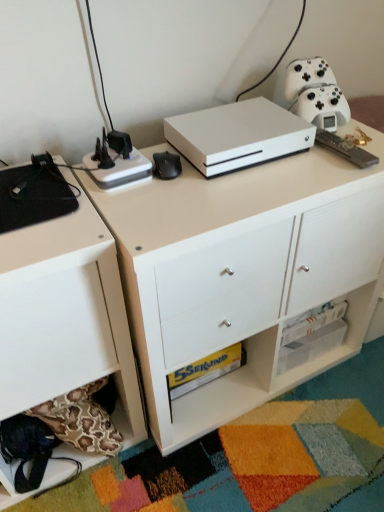
Question: Considering the relative sizes of white matte gaming console at center, which ranks as the 3th appliance in left-to-right order, and white matte chest of drawers at lower left in the image provided, is white matte gaming console at center, which ranks as the 3th appliance in left-to-right order, wider than white matte chest of drawers at lower left?

Choices:
 (A) yes
 (B) no

Answer: (B)

Question: Is white matte gaming console at center, which ranks as the 3th appliance in left-to-right order, behind white matte chest of drawers at lower left?

Choices:
 (A) no
 (B) yes

Answer: (B)

Question: Is white matte gaming console at center, which ranks as the 3th appliance in left-to-right order, smaller than white matte chest of drawers at lower left?

Choices:
 (A) yes
 (B) no

Answer: (A)

Question: Are white matte gaming console at center, which is the 2th appliance in right-to-left order, and white matte chest of drawers at lower left located far from each other?

Choices:
 (A) yes
 (B) no

Answer: (B)

Question: From a real-world perspective, is white matte gaming console at center, which ranks as the 3th appliance in left-to-right order, positioned over white matte chest of drawers at lower left based on gravity?

Choices:
 (A) no
 (B) yes

Answer: (B)

Question: From a real-world perspective, is white matte chest of drawers at lower left physically located above or below black plastic power strip at upper left, the second appliance when ordered from left to right?

Choices:
 (A) below
 (B) above

Answer: (A)

Question: From the image's perspective, is white matte chest of drawers at lower left above or below black plastic power strip at upper left, the second appliance when ordered from left to right?

Choices:
 (A) below
 (B) above

Answer: (A)

Question: Considering the positions of white matte chest of drawers at lower left and black plastic power strip at upper left, which is the 3th appliance from right to left, in the image, is white matte chest of drawers at lower left taller or shorter than black plastic power strip at upper left, which is the 3th appliance from right to left,?

Choices:
 (A) tall
 (B) short

Answer: (A)

Question: Based on their sizes in the image, would you say white matte chest of drawers at lower left is bigger or smaller than black plastic power strip at upper left, the second appliance when ordered from left to right?

Choices:
 (A) big
 (B) small

Answer: (A)

Question: Considering the positions of black plastic power strip at upper left, the second appliance when ordered from left to right, and white matte xbox one s at center in the image, is black plastic power strip at upper left, the second appliance when ordered from left to right, wider or thinner than white matte xbox one s at center?

Choices:
 (A) wide
 (B) thin

Answer: (B)

Question: From the image's perspective, is black plastic power strip at upper left, the second appliance when ordered from left to right, positioned above or below white matte xbox one s at center?

Choices:
 (A) above
 (B) below

Answer: (A)

Question: Would you say black plastic power strip at upper left, which is the 3th appliance from right to left, is to the left or to the right of white matte xbox one s at center in the picture?

Choices:
 (A) left
 (B) right

Answer: (A)

Question: In terms of height, does black plastic power strip at upper left, which is the 3th appliance from right to left, look taller or shorter compared to white matte xbox one s at center?

Choices:
 (A) short
 (B) tall

Answer: (A)

Question: From the image's perspective, is white matte xbox one s at center located above or below white matte chest of drawers at lower left?

Choices:
 (A) above
 (B) below

Answer: (A)

Question: Relative to white matte chest of drawers at lower left, is white matte xbox one s at center in front or behind?

Choices:
 (A) behind
 (B) front

Answer: (A)